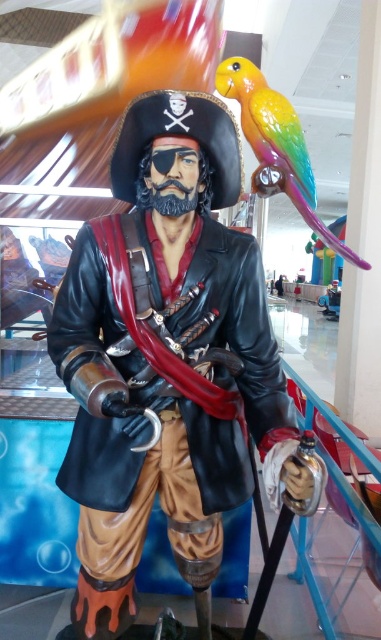
Question: Is glossy black pirate at center thinner than rainbow glossy parrot at upper right?

Choices:
 (A) no
 (B) yes

Answer: (B)

Question: Is glossy black pirate at center closer to the viewer compared to rainbow glossy parrot at upper right?

Choices:
 (A) yes
 (B) no

Answer: (A)

Question: Considering the relative positions of glossy black pirate at center and rainbow glossy parrot at upper right in the image provided, where is glossy black pirate at center located with respect to rainbow glossy parrot at upper right?

Choices:
 (A) right
 (B) left

Answer: (B)

Question: Which object appears closest to the camera in this image?

Choices:
 (A) rainbow glossy parrot at upper right
 (B) glossy black pirate at center

Answer: (B)